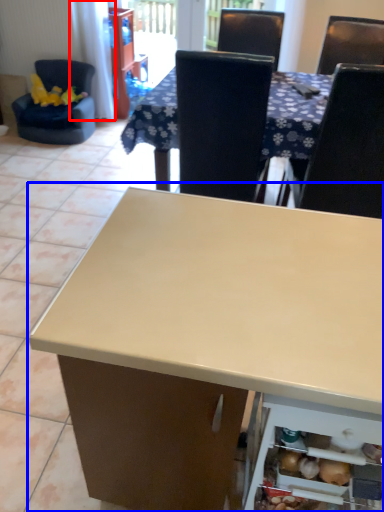
Question: Among these objects, which one is nearest to the camera, curtain (highlighted by a red box) or table (highlighted by a blue box)?

Choices:
 (A) curtain
 (B) table

Answer: (B)